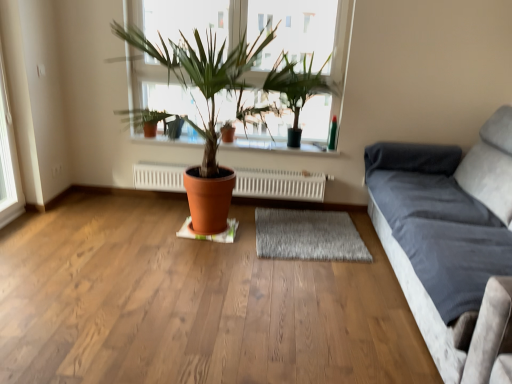
Question: Considering the relative sizes of gray shaggy rug at center and white radiator at center in the image provided, is gray shaggy rug at center taller than white radiator at center?

Choices:
 (A) no
 (B) yes

Answer: (A)

Question: Is gray shaggy rug at center positioned before white radiator at center?

Choices:
 (A) no
 (B) yes

Answer: (B)

Question: Is gray shaggy rug at center not near white radiator at center?

Choices:
 (A) yes
 (B) no

Answer: (B)

Question: Is gray shaggy rug at center to the left of white radiator at center from the viewer's perspective?

Choices:
 (A) no
 (B) yes

Answer: (A)

Question: Is gray shaggy rug at center smaller than white radiator at center?

Choices:
 (A) no
 (B) yes

Answer: (B)

Question: Is gray shaggy rug at center wider than white radiator at center?

Choices:
 (A) no
 (B) yes

Answer: (B)

Question: Is velvet gray couch at right turned away from white radiator at center?

Choices:
 (A) yes
 (B) no

Answer: (B)

Question: Can you confirm if velvet gray couch at right is bigger than white radiator at center?

Choices:
 (A) no
 (B) yes

Answer: (B)

Question: Is the surface of velvet gray couch at right in direct contact with white radiator at center?

Choices:
 (A) no
 (B) yes

Answer: (A)

Question: From the image's perspective, is velvet gray couch at right over white radiator at center?

Choices:
 (A) no
 (B) yes

Answer: (A)

Question: Could you tell me if velvet gray couch at right is facing white radiator at center?

Choices:
 (A) yes
 (B) no

Answer: (A)

Question: Considering the relative positions of velvet gray couch at right and white radiator at center in the image provided, is velvet gray couch at right to the left of white radiator at center from the viewer's perspective?

Choices:
 (A) yes
 (B) no

Answer: (B)

Question: Is terracotta pot at center surrounded by white radiator at center?

Choices:
 (A) no
 (B) yes

Answer: (A)